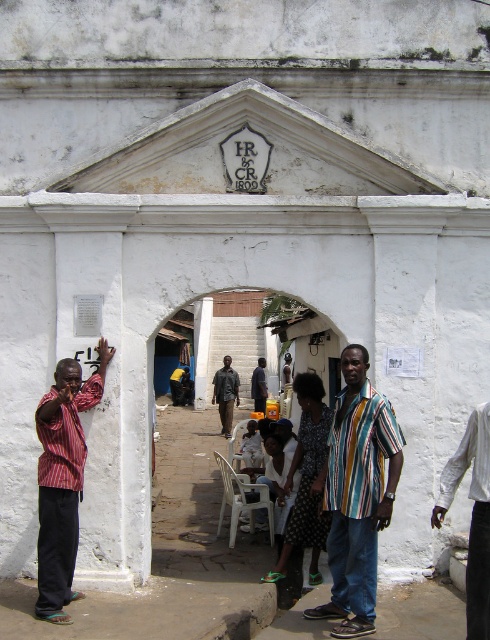
Measure the distance between point (80, 369) and camera.

8.18 meters

Locate an element on the screen. The height and width of the screenshot is (640, 490). striped fabric shirt at left is located at coordinates (63, 480).

Between striped fabric shirt at left and dark brown leather jacket at center, which one appears on the left side from the viewer's perspective?

striped fabric shirt at left

Is striped fabric shirt at left positioned before dark brown leather jacket at center?

Yes, striped fabric shirt at left is in front of dark brown leather jacket at center.

You are a GUI agent. You are given a task and a screenshot of the screen. Output one action in this format:
    pyautogui.click(x=<x>, y=<y>)
    Task: Click on the striped fabric shirt at left
    The image size is (490, 640).
    Given the screenshot: What is the action you would take?
    pyautogui.click(x=63, y=480)

Is dark brown leather jacket at center behind dark blue shirt at center?

No, dark brown leather jacket at center is closer to the viewer.

Looking at this image, does dark brown leather jacket at center appear on the right side of dark blue shirt at center?

Incorrect, dark brown leather jacket at center is not on the right side of dark blue shirt at center.

Which is in front, point (231, 408) or point (256, 403)?

Point (231, 408) is in front.

Locate an element on the screen. This screenshot has width=490, height=640. dark brown leather jacket at center is located at coordinates (225, 394).